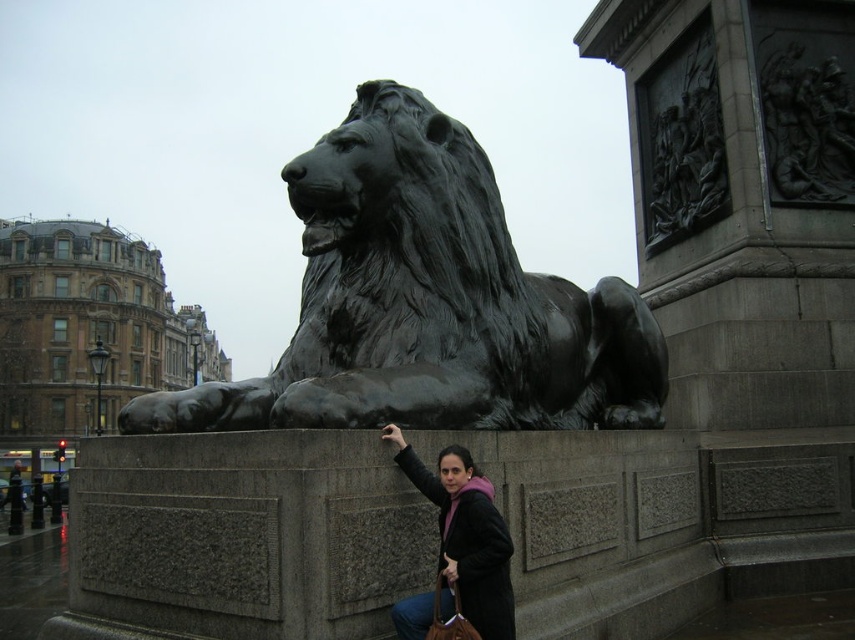
You are a photographer trying to capture a photo of the black polished stone lion at center and the matte black jacket at lower center. Since you want both subjects to be in focus, you need to know which one is taller. Can you tell me which one is taller?

The black polished stone lion at center has a greater height compared to the matte black jacket at lower center, so the black polished stone lion at center is taller.

You are standing 5 meters away from the camera. You want to take a photo of the black polished stone lion at center. Can you reach the lion to touch it?

The black polished stone lion at center is 11.04 meters away from camera. Since you are 5 meters away from the camera, you are 6.04 meters away from the lion. Therefore, you cannot reach it to touch it.

You are standing at the point labeled as point [426,301] in the image. Which object is exactly at your current position?

The black polished stone lion at center is located at point [426,301], so the object exactly at your current position is the black polished stone lion at center.